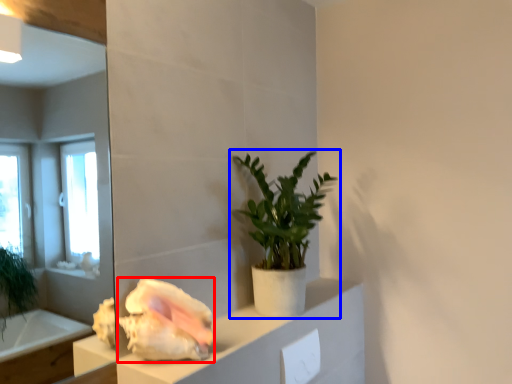
Question: Which point is further to the camera, flower (highlighted by a red box) or houseplant (highlighted by a blue box)?

Choices:
 (A) flower
 (B) houseplant

Answer: (B)